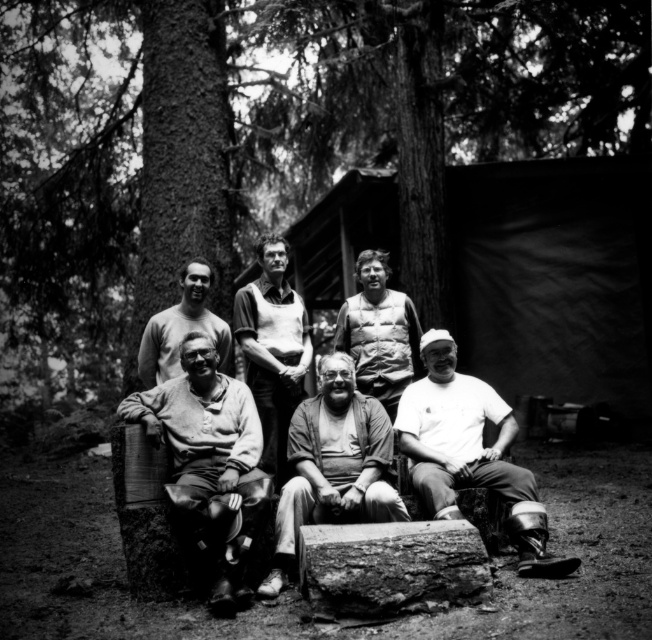
Does smooth gray sweater at center have a lesser height compared to white matte shirt at lower right?

Incorrect, smooth gray sweater at center's height does not fall short of white matte shirt at lower right's.

Identify the location of smooth gray sweater at center. pyautogui.click(x=143, y=518).

Find the location of a particular element. smooth gray sweater at center is located at coordinates (143, 518).

Between smooth gray sweater at center and smooth white shirt at center, which one is positioned lower?

Positioned lower is smooth white shirt at center.

Is smooth gray sweater at center bigger than smooth white shirt at center?

Yes, smooth gray sweater at center is bigger than smooth white shirt at center.

Is point (113, 477) more distant than point (261, 396)?

No, (113, 477) is in front of (261, 396).

This screenshot has width=652, height=640. Find the location of `smooth gray sweater at center`. smooth gray sweater at center is located at coordinates (143, 518).

Does smooth white shirt at center have a lesser height compared to light gray sweater at center?

In fact, smooth white shirt at center may be taller than light gray sweater at center.

Is smooth white shirt at center above light gray sweater at center?

Incorrect, smooth white shirt at center is not positioned above light gray sweater at center.

Who is more distant from viewer, [271,285] or [194,294]?

Point [271,285]

This screenshot has height=640, width=652. Find the location of `smooth white shirt at center`. smooth white shirt at center is located at coordinates (273, 348).